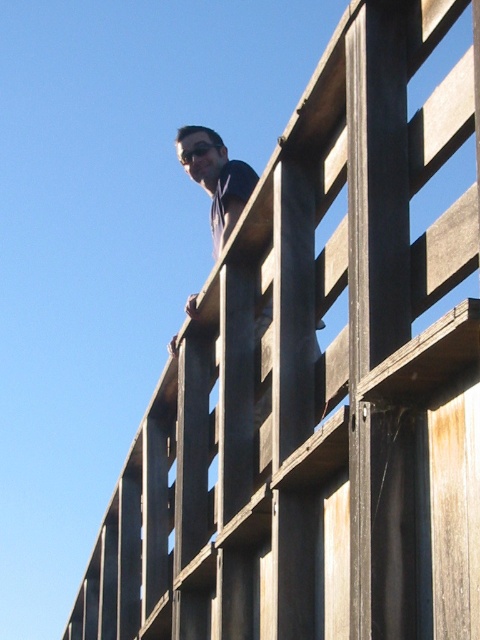
You are a photographer trying to capture the wooden structure from the best angle. You notice two points on the structure labeled as point (217,172) and point (214,141). Which point should you focus on to ensure it appears closer in the photo?

Point (217,172) is closer to the camera than point (214,141), so focusing on point (217,172) will make it appear closer in the photo.